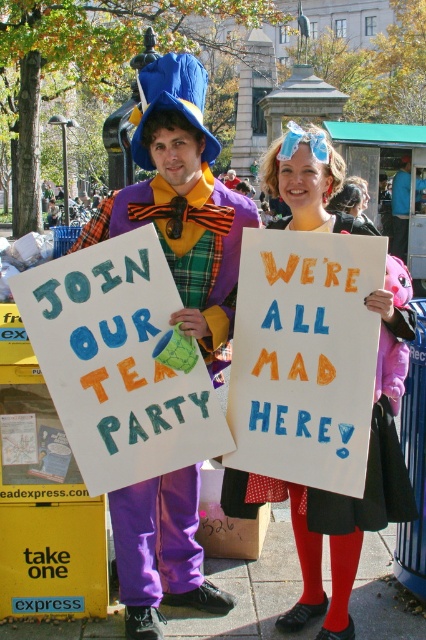
You are a passerby who wants to read both the handwritten paper sign at center and the polka dot fabric dress at center. Which one is taller?

The handwritten paper sign at center is taller than the polka dot fabric dress at center.